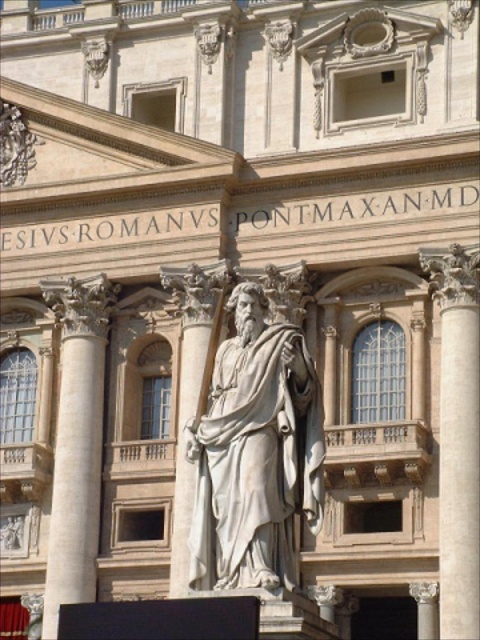
Question: Which object is farther from the camera taking this photo?

Choices:
 (A) white marble column at left
 (B) white marble statue at center
 (C) white marble column at center

Answer: (A)

Question: Which point appears closest to the camera in this image?

Choices:
 (A) [100, 301]
 (B) [247, 580]

Answer: (B)

Question: Can you confirm if white marble statue at center is thinner than white marble column at center?

Choices:
 (A) no
 (B) yes

Answer: (A)

Question: Does white marble statue at center appear on the right side of white marble column at left?

Choices:
 (A) no
 (B) yes

Answer: (B)

Question: Which object appears closest to the camera in this image?

Choices:
 (A) white marble column at left
 (B) white marble column at center

Answer: (B)

Question: Does white marble statue at center have a larger size compared to white marble column at center?

Choices:
 (A) no
 (B) yes

Answer: (B)